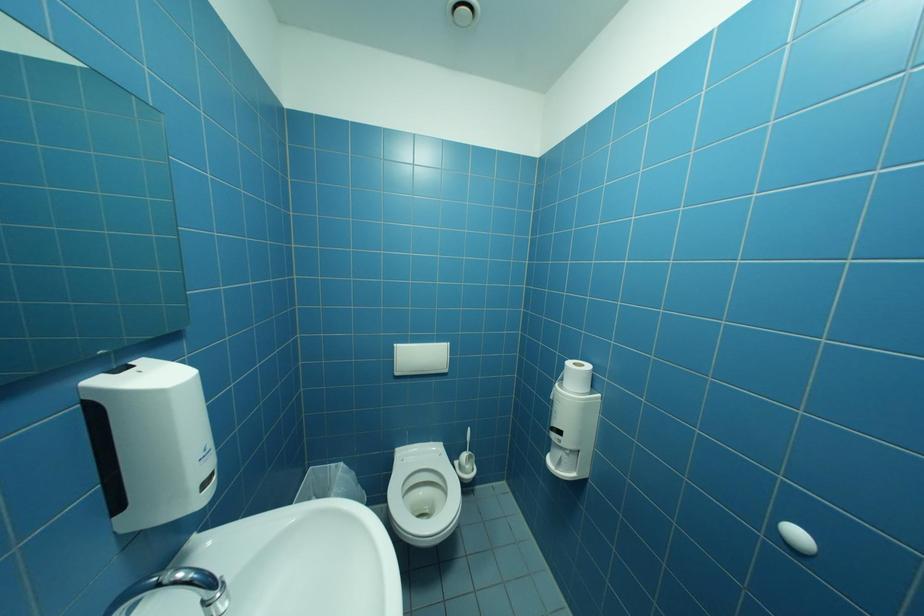
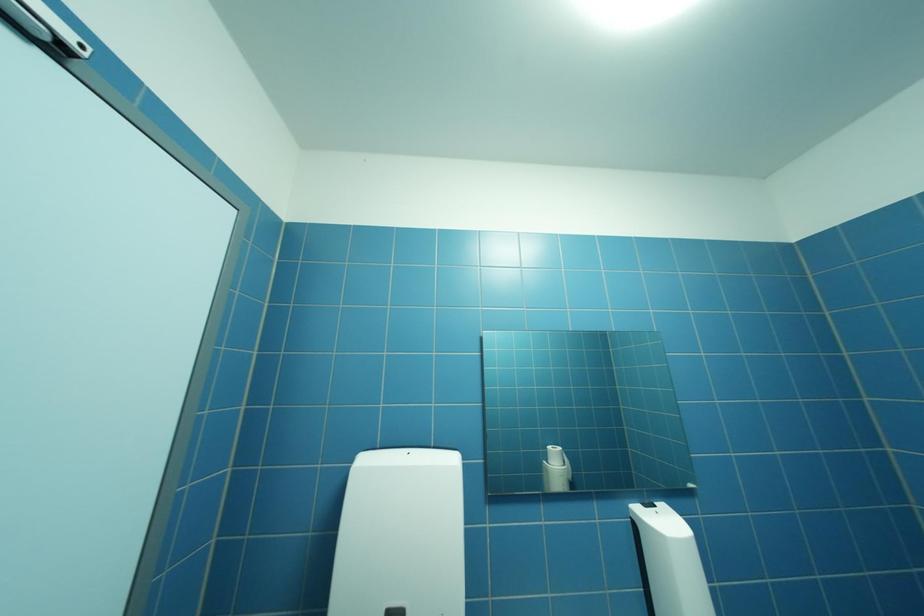
In the scene shown: The images are taken continuously from a first-person perspective. In which direction is your viewpoint rotating?

The camera rotated toward left-up.